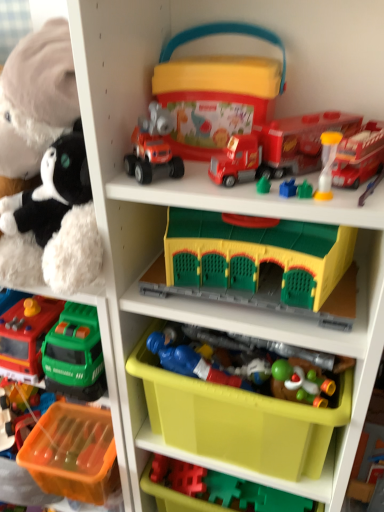
Question: Is translucent yellow hourglass at upper right, the 6th toy in the bottom-to-top sequence, completely or partially inside orange plastic storage box at lower left, placed as the third storage box when sorted from top to bottom?

Choices:
 (A) yes
 (B) no

Answer: (B)

Question: Is orange plastic storage box at lower left, which is the first storage box from bottom to top, wider than translucent yellow hourglass at upper right, which appears as the 5th toy when viewed from the top?

Choices:
 (A) no
 (B) yes

Answer: (B)

Question: Can you confirm if orange plastic storage box at lower left, which is the first storage box from bottom to top, is thinner than translucent yellow hourglass at upper right, the 6th toy in the bottom-to-top sequence?

Choices:
 (A) no
 (B) yes

Answer: (A)

Question: Is orange plastic storage box at lower left, which is the first storage box from bottom to top, far away from translucent yellow hourglass at upper right, which appears as the 5th toy when viewed from the top?

Choices:
 (A) no
 (B) yes

Answer: (A)

Question: From a real-world perspective, is orange plastic storage box at lower left, which is the first storage box from bottom to top, positioned over translucent yellow hourglass at upper right, which appears as the 5th toy when viewed from the top, based on gravity?

Choices:
 (A) yes
 (B) no

Answer: (B)

Question: Is point (177, 359) positioned closer to the camera than point (177, 113)?

Choices:
 (A) closer
 (B) farther

Answer: (B)

Question: In terms of height, does blue plastic toy soldier at center, which is counted as the fourth toy, starting from the bottom, look taller or shorter compared to matte plastic storage box at upper center, the third storage box positioned from the bottom?

Choices:
 (A) short
 (B) tall

Answer: (A)

Question: From the image's perspective, is blue plastic toy soldier at center, which is counted as the fourth toy, starting from the bottom, positioned above or below matte plastic storage box at upper center, positioned as the first storage box in top-to-bottom order?

Choices:
 (A) above
 (B) below

Answer: (B)

Question: Would you say blue plastic toy soldier at center, the 7th toy in the top-to-bottom sequence, is to the left or to the right of matte plastic storage box at upper center, the third storage box positioned from the bottom, in the picture?

Choices:
 (A) right
 (B) left

Answer: (B)

Question: In terms of height, does orange plastic storage box at lower left, which is the first storage box from bottom to top, look taller or shorter compared to rubberized red truck at center, which is counted as the eighth toy, starting from the bottom?

Choices:
 (A) short
 (B) tall

Answer: (B)

Question: From a real-world perspective, relative to rubberized red truck at center, which is the third toy in top-to-bottom order, is orange plastic storage box at lower left, which is the first storage box from bottom to top, vertically above or below?

Choices:
 (A) above
 (B) below

Answer: (B)

Question: Is orange plastic storage box at lower left, placed as the third storage box when sorted from top to bottom, bigger or smaller than rubberized red truck at center, which is counted as the eighth toy, starting from the bottom?

Choices:
 (A) big
 (B) small

Answer: (A)

Question: Which is correct: orange plastic storage box at lower left, which is the first storage box from bottom to top, is inside rubberized red truck at center, which is counted as the eighth toy, starting from the bottom, or outside of it?

Choices:
 (A) outside
 (B) inside

Answer: (A)

Question: In terms of height, does translucent orange plastic tray at lower left, which appears as the 2th toy when ordered from the bottom, look taller or shorter compared to orange plastic storage box at lower left, placed as the third storage box when sorted from top to bottom?

Choices:
 (A) tall
 (B) short

Answer: (B)

Question: Considering the relative positions of translucent orange plastic tray at lower left, which appears as the 2th toy when ordered from the bottom, and orange plastic storage box at lower left, placed as the third storage box when sorted from top to bottom, in the image provided, is translucent orange plastic tray at lower left, which appears as the 2th toy when ordered from the bottom, to the left or to the right of orange plastic storage box at lower left, placed as the third storage box when sorted from top to bottom,?

Choices:
 (A) right
 (B) left

Answer: (B)